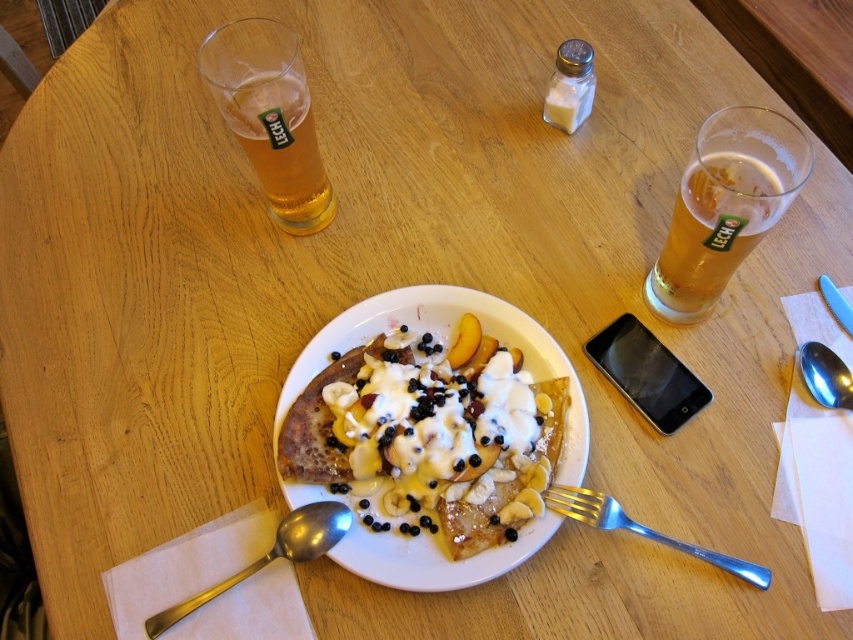
Question: Can you confirm if silver metallic fork at lower right is positioned to the right of satin silver spoon at upper right?

Choices:
 (A) yes
 (B) no

Answer: (B)

Question: Does golden amber liquid at upper right have a larger size compared to silver metallic fork at lower right?

Choices:
 (A) yes
 (B) no

Answer: (A)

Question: Is golden crispy crepe topped with cream, fruit, and blueberries at center below satin silver spoon at lower left?

Choices:
 (A) yes
 (B) no

Answer: (B)

Question: Which point is closer to the camera taking this photo?

Choices:
 (A) (537, 456)
 (B) (814, 344)
 (C) (636, 524)

Answer: (C)

Question: Which point is closer to the camera?

Choices:
 (A) (747, 572)
 (B) (689, 161)

Answer: (B)

Question: Which is farther from the satin silver spoon at lower left?

Choices:
 (A) silver metallic fork at lower right
 (B) golden crispy crepe topped with cream, fruit, and blueberries at center

Answer: (A)